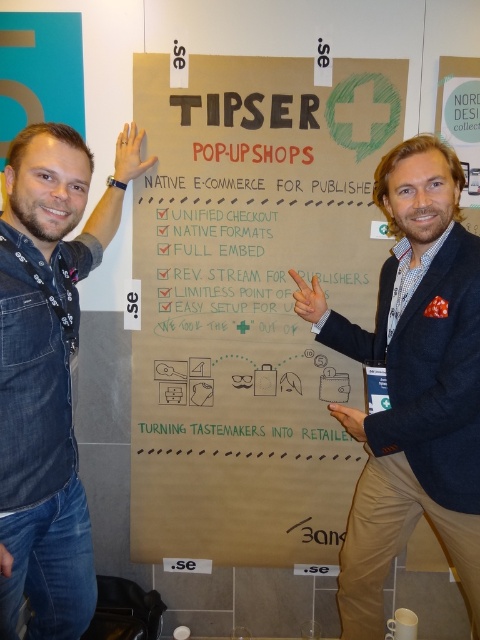
Is brown cardboard sign at center bigger than blue denim shirt at left?

Yes.

Measure the distance between point (247,552) and camera.

They are 7.42 feet apart.

Which is behind, point (168, 342) or point (67, 195)?

Positioned behind is point (168, 342).

Identify the location of brown cardboard sign at center. This screenshot has width=480, height=640. (251, 300).

Does blue denim jeans at center lie in front of matte black hand at lower left?

No, it is not.

Can you confirm if blue denim jeans at center is smaller than matte black hand at lower left?

Actually, blue denim jeans at center might be larger than matte black hand at lower left.

The height and width of the screenshot is (640, 480). Describe the element at coordinates (416, 385) in the screenshot. I see `blue denim jeans at center` at that location.

Find the location of a particular element. The height and width of the screenshot is (640, 480). blue denim jeans at center is located at coordinates (416, 385).

Is point (8, 419) more distant than point (346, 413)?

No, it is in front of (346, 413).

Which is below, blue denim shirt at left or matte black hand at center?

matte black hand at center is lower down.

Locate an element on the screen. This screenshot has height=640, width=480. blue denim shirt at left is located at coordinates (46, 378).

The width and height of the screenshot is (480, 640). Find the location of `blue denim shirt at left`. blue denim shirt at left is located at coordinates (46, 378).